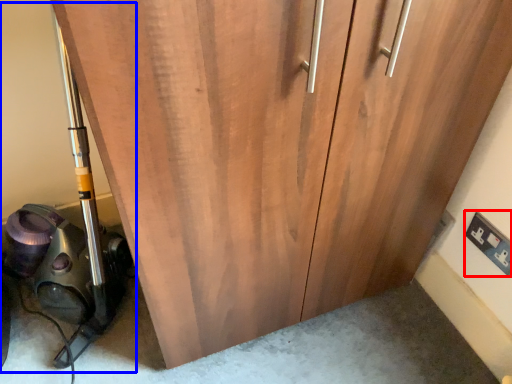
Question: Which of the following is the farthest to the observer, electric outlet (highlighted by a red box) or equipment (highlighted by a blue box)?

Choices:
 (A) electric outlet
 (B) equipment

Answer: (A)